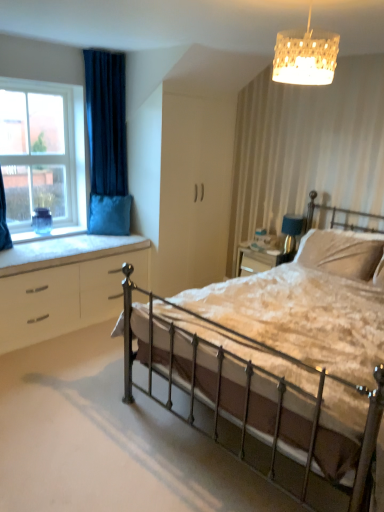
Question: Is velvet beige pillow at center, placed as the first pillow when sorted from right to left, oriented towards white glossy chest of drawers at lower left?

Choices:
 (A) no
 (B) yes

Answer: (A)

Question: From the image's perspective, would you say velvet beige pillow at center, the 2th pillow when ordered from back to front, is shown under white glossy chest of drawers at lower left?

Choices:
 (A) yes
 (B) no

Answer: (B)

Question: Can you confirm if velvet beige pillow at center, the first pillow from the front, is smaller than white glossy chest of drawers at lower left?

Choices:
 (A) yes
 (B) no

Answer: (A)

Question: Is velvet beige pillow at center, the 2th pillow when ordered from back to front, looking in the opposite direction of white glossy chest of drawers at lower left?

Choices:
 (A) no
 (B) yes

Answer: (A)

Question: Considering the relative sizes of velvet beige pillow at center, placed as the first pillow when sorted from right to left, and white glossy chest of drawers at lower left in the image provided, is velvet beige pillow at center, placed as the first pillow when sorted from right to left, bigger than white glossy chest of drawers at lower left?

Choices:
 (A) yes
 (B) no

Answer: (B)

Question: Is the depth of velvet beige pillow at center, the first pillow from the front, greater than that of white glossy chest of drawers at lower left?

Choices:
 (A) no
 (B) yes

Answer: (B)

Question: Is velvet beige pillow at center, the 2th pillow when ordered from back to front, inside white glossy chest of drawers at lower left?

Choices:
 (A) yes
 (B) no

Answer: (B)

Question: Is the surface of white glossy chest of drawers at lower left in direct contact with velvet beige pillow at center, the 2th pillow when ordered from back to front?

Choices:
 (A) yes
 (B) no

Answer: (B)

Question: Is white glossy chest of drawers at lower left at the left side of velvet beige pillow at center, placed as the first pillow when sorted from right to left?

Choices:
 (A) yes
 (B) no

Answer: (A)

Question: From a real-world perspective, is white glossy chest of drawers at lower left physically below velvet beige pillow at center, the 2th pillow when ordered from back to front?

Choices:
 (A) no
 (B) yes

Answer: (B)

Question: From the image's perspective, is white glossy chest of drawers at lower left located beneath velvet beige pillow at center, acting as the second pillow starting from the left?

Choices:
 (A) no
 (B) yes

Answer: (B)

Question: Is white glossy chest of drawers at lower left wider than velvet beige pillow at center, placed as the first pillow when sorted from right to left?

Choices:
 (A) no
 (B) yes

Answer: (B)

Question: Can you confirm if clear glass window at left is positioned to the left of white textured lampshade at upper center?

Choices:
 (A) yes
 (B) no

Answer: (A)